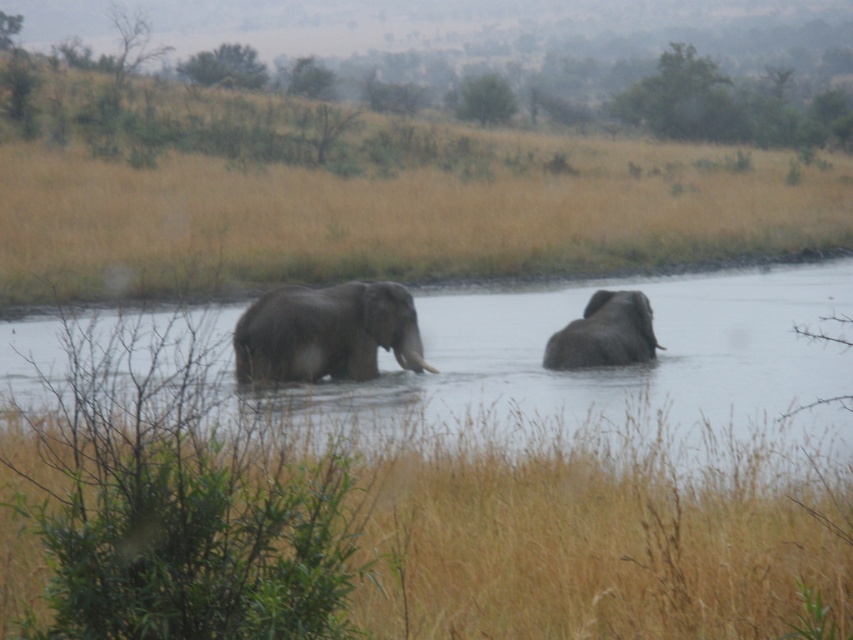
You are standing at the origin point in the image and want to reach the dry grass at lower center. Which direction should you move in to get there?

The dry grass at lower center is located at point 0.856 on the x axis and 0.696 on the y axis. Since the origin is at the bottom left corner, you should move to the right and slightly upwards to reach it.

You are standing at the point marked as point (360,195) in the image. Based on the scene description, what type of terrain are you currently standing on?

The point (360,195) is on dry grass at center, so you are standing on dry grass.